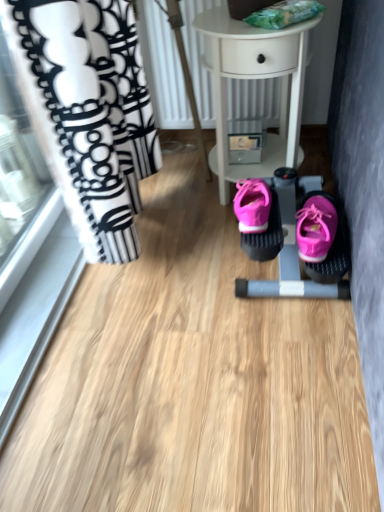
The width and height of the screenshot is (384, 512). What do you see at coordinates (316, 228) in the screenshot? I see `pink suede shoe at center` at bounding box center [316, 228].

Find the location of a particular element. white glossy table at center is located at coordinates (255, 79).

You are a GUI agent. You are given a task and a screenshot of the screen. Output one action in this format:
    pyautogui.click(x=<x>, y=<y>)
    Task: Click on the pink fabric baby carriage at center
    
    Given the screenshot: What is the action you would take?
    pyautogui.click(x=286, y=243)

Is there a large distance between pink suede shoe at center and pink fabric baby carriage at center?

No, pink suede shoe at center is not far away from pink fabric baby carriage at center.

Considering the relative sizes of pink suede shoe at center and pink fabric baby carriage at center in the image provided, is pink suede shoe at center smaller than pink fabric baby carriage at center?

Indeed, pink suede shoe at center has a smaller size compared to pink fabric baby carriage at center.

Is pink fabric baby carriage at center at the back of pink suede shoe at center?

No.

Is white glossy table at center turned away from pink fabric baby carriage at center?

No, white glossy table at center's orientation is not away from pink fabric baby carriage at center.

What's the angular difference between white glossy table at center and pink fabric baby carriage at center's facing directions?

The angular difference between white glossy table at center and pink fabric baby carriage at center is 1.96e-05 degrees.

Which object is thinner, white glossy table at center or pink fabric baby carriage at center?

With smaller width is white glossy table at center.

Based on the photo, considering the relative positions of pink fabric baby carriage at center and white glossy table at center in the image provided, is pink fabric baby carriage at center in front of white glossy table at center?

No, it is not.

Considering the relative positions of pink fabric baby carriage at center and white glossy table at center in the image provided, is pink fabric baby carriage at center to the left or to the right of white glossy table at center?

In the image, pink fabric baby carriage at center appears on the right side of white glossy table at center.

Are pink fabric baby carriage at center and white glossy table at center beside each other?

No, pink fabric baby carriage at center is not touching white glossy table at center.

From a real-world perspective, is pink fabric baby carriage at center beneath white glossy table at center?

Yes, from a real-world perspective, pink fabric baby carriage at center is beneath white glossy table at center.

In the image, is pink suede shoe at center positioned in front of or behind white glossy table at center?

pink suede shoe at center is in front of white glossy table at center.

Is pink suede shoe at center completely or partially outside of white glossy table at center?

Yes, pink suede shoe at center is outside of white glossy table at center.

From their relative heights in the image, would you say pink suede shoe at center is taller or shorter than white glossy table at center?

Considering their sizes, pink suede shoe at center has less height than white glossy table at center.

Which is more to the left, pink suede shoe at center or white glossy table at center?

white glossy table at center.

Between pink fabric baby carriage at center and pink suede shoe at center, which one is positioned in front?

Positioned in front is pink suede shoe at center.

Considering the sizes of pink fabric baby carriage at center and pink suede shoe at center in the image, is pink fabric baby carriage at center bigger or smaller than pink suede shoe at center?

Considering their sizes, pink fabric baby carriage at center takes up more space than pink suede shoe at center.

The image size is (384, 512). In order to click on footwear lying on the right of pink fabric baby carriage at center in this screenshot , I will do [x=316, y=228].

Is pink fabric baby carriage at center not within pink suede shoe at center?

Yes, pink fabric baby carriage at center is outside of pink suede shoe at center.

Which is behind, point (234, 29) or point (336, 214)?

Point (336, 214)

Who is taller, white glossy table at center or pink suede shoe at center?

white glossy table at center.

From a real-world perspective, between white glossy table at center and pink suede shoe at center, who is vertically higher?

From a 3D spatial view, white glossy table at center is above.

Where is `footwear lying in front of the pink fabric baby carriage at center`? This screenshot has height=512, width=384. footwear lying in front of the pink fabric baby carriage at center is located at coordinates (316, 228).

I want to click on baby carriage on the right of the white glossy table at center, so click(x=286, y=243).

Looking at the image, which one is located closer to pink fabric baby carriage at center, white glossy table at center or pink suede shoe at center?

Among the two, pink suede shoe at center is located nearer to pink fabric baby carriage at center.

When comparing their distances from white glossy table at center, does pink fabric baby carriage at center or pink suede shoe at center seem further?

pink suede shoe at center is further to white glossy table at center.

Estimate the real-world distances between objects in this image. Which object is closer to pink fabric baby carriage at center, pink suede shoe at center or white glossy table at center?

pink suede shoe at center lies closer to pink fabric baby carriage at center than the other object.

Looking at the image, which one is located closer to pink suede shoe at center, white glossy table at center or pink fabric baby carriage at center?

pink fabric baby carriage at center is closer to pink suede shoe at center.

Looking at the image, which one is located further to pink suede shoe at center, pink fabric baby carriage at center or white glossy table at center?

Among the two, white glossy table at center is located further to pink suede shoe at center.

When comparing their distances from white glossy table at center, does pink suede shoe at center or pink fabric baby carriage at center seem closer?

pink fabric baby carriage at center is positioned closer to the anchor white glossy table at center.

This screenshot has height=512, width=384. I want to click on footwear that lies between white glossy table at center and pink fabric baby carriage at center from top to bottom, so click(316, 228).